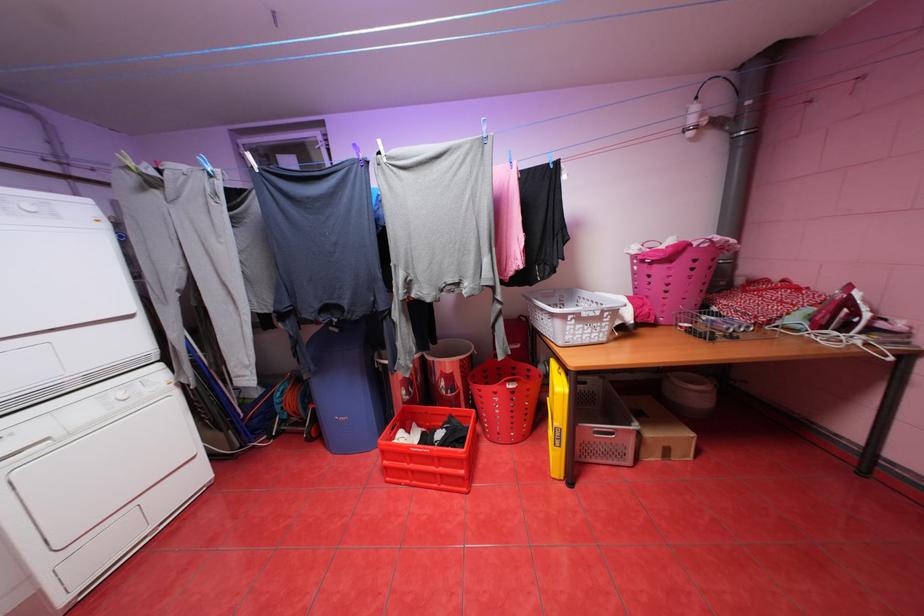
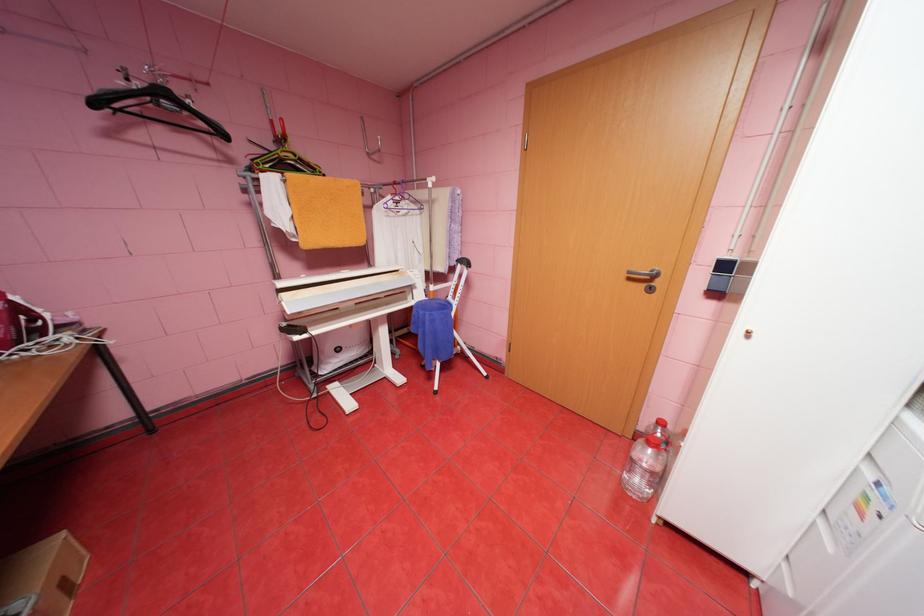
The point at (856, 302) is marked in the first image. Where is the corresponding point in the second image?

(26, 309)